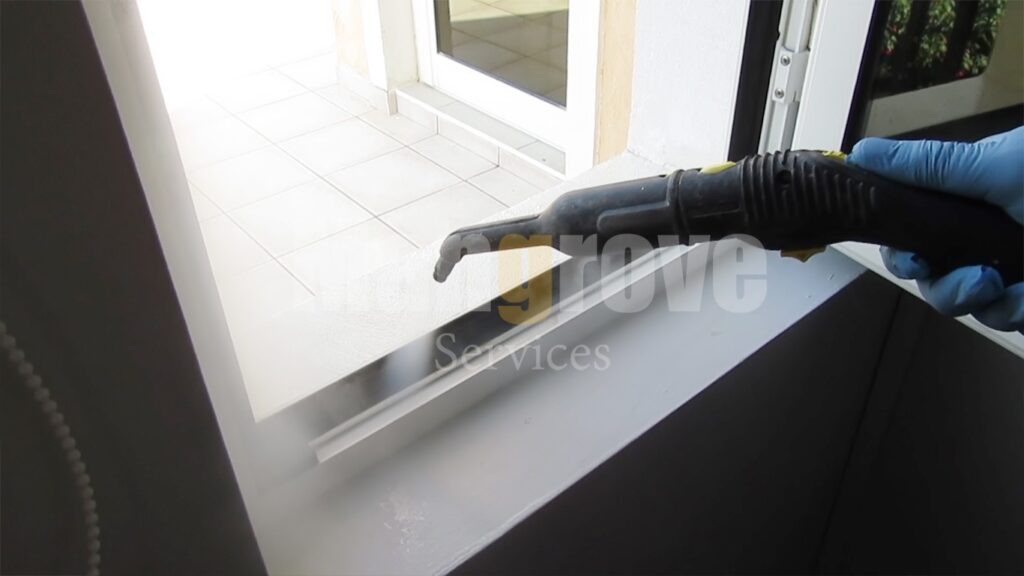
Image resolution: width=1024 pixels, height=576 pixels. Identify the location of white door. (535, 115).